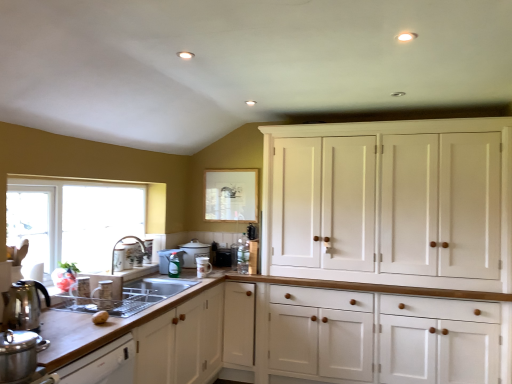
Where is `free area in between satin silver sink at lower left and brown matte potato at lower left`? Image resolution: width=512 pixels, height=384 pixels. free area in between satin silver sink at lower left and brown matte potato at lower left is located at coordinates (84, 312).